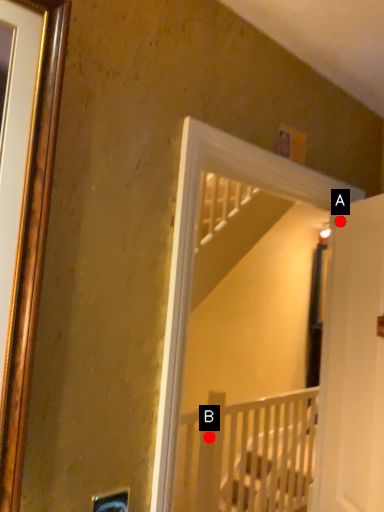
Question: Two points are circled on the image, labeled by A and B beside each circle. Among these points, which one is nearest to the camera?

Choices:
 (A) A is closer
 (B) B is closer

Answer: (A)